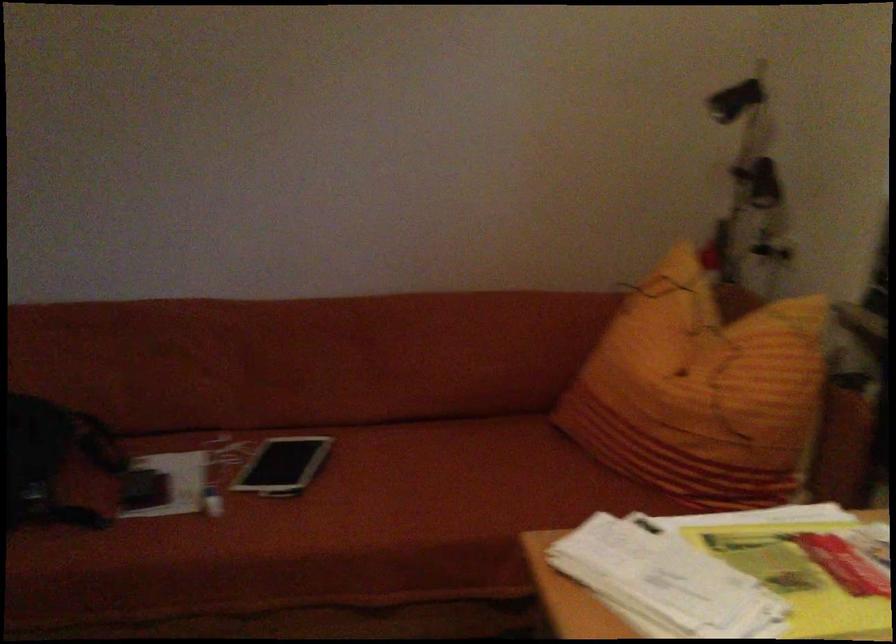
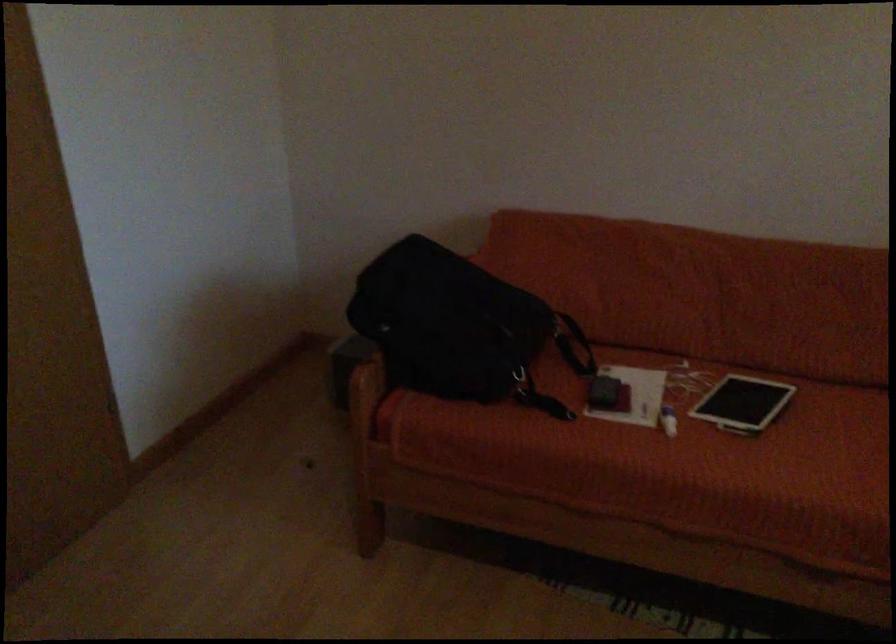
Where in the second image is the point corresponding to (x=95, y=430) from the first image?

(567, 332)